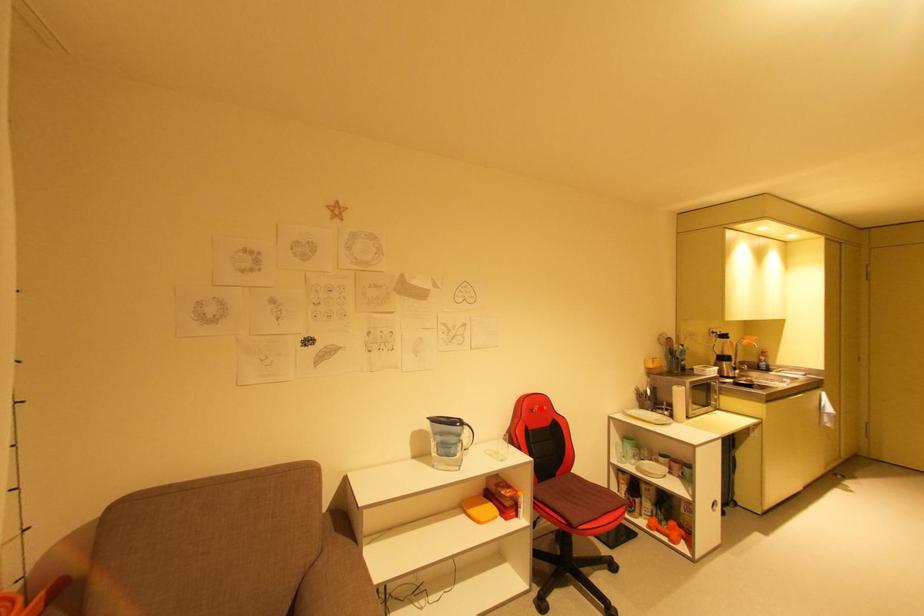
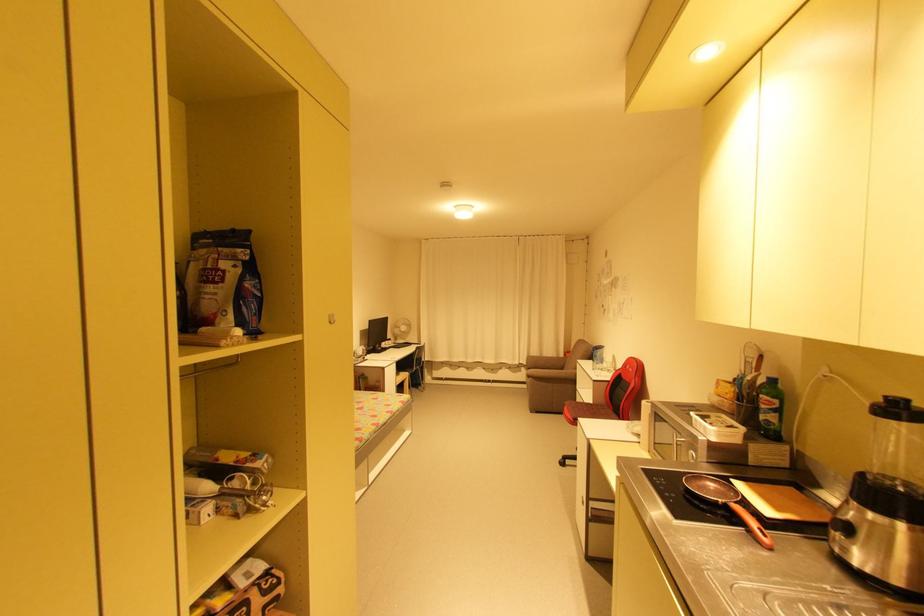
The point at the highlighted location is marked in the first image. Where is the corresponding point in the second image?

(631, 367)